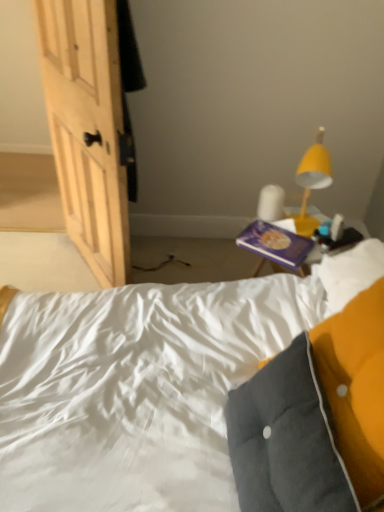
Question: Does velvety gray pillow at lower right come in front of yellow matte lamp at upper right?

Choices:
 (A) no
 (B) yes

Answer: (B)

Question: From a real-world perspective, is velvety gray pillow at lower right under yellow matte lamp at upper right?

Choices:
 (A) no
 (B) yes

Answer: (B)

Question: From a real-world perspective, does velvety gray pillow at lower right stand above yellow matte lamp at upper right?

Choices:
 (A) no
 (B) yes

Answer: (A)

Question: Would you say velvety gray pillow at lower right contains yellow matte lamp at upper right?

Choices:
 (A) yes
 (B) no

Answer: (B)

Question: Can you confirm if velvety gray pillow at lower right is wider than yellow matte lamp at upper right?

Choices:
 (A) yes
 (B) no

Answer: (A)

Question: Is velvety gray pillow at lower right in front of or behind yellow matte lamp at upper right in the image?

Choices:
 (A) behind
 (B) front

Answer: (B)

Question: From the image's perspective, is velvety gray pillow at lower right positioned above or below yellow matte lamp at upper right?

Choices:
 (A) above
 (B) below

Answer: (B)

Question: Considering the positions of velvety gray pillow at lower right and yellow matte lamp at upper right in the image, is velvety gray pillow at lower right wider or thinner than yellow matte lamp at upper right?

Choices:
 (A) wide
 (B) thin

Answer: (A)

Question: Considering the relative positions of velvety gray pillow at lower right and yellow matte lamp at upper right in the image provided, is velvety gray pillow at lower right to the left or to the right of yellow matte lamp at upper right?

Choices:
 (A) right
 (B) left

Answer: (B)

Question: Visually, is velvety gray pillow at lower right positioned to the left or to the right of purple matte book at upper right?

Choices:
 (A) right
 (B) left

Answer: (B)

Question: Considering the positions of velvety gray pillow at lower right and purple matte book at upper right in the image, is velvety gray pillow at lower right bigger or smaller than purple matte book at upper right?

Choices:
 (A) small
 (B) big

Answer: (B)

Question: From their relative heights in the image, would you say velvety gray pillow at lower right is taller or shorter than purple matte book at upper right?

Choices:
 (A) short
 (B) tall

Answer: (B)

Question: From a real-world perspective, is velvety gray pillow at lower right above or below purple matte book at upper right?

Choices:
 (A) below
 (B) above

Answer: (B)

Question: Relative to yellow matte lamp at upper right, is purple matte book at upper right in front or behind?

Choices:
 (A) behind
 (B) front

Answer: (A)

Question: From the image's perspective, is purple matte book at upper right above or below yellow matte lamp at upper right?

Choices:
 (A) below
 (B) above

Answer: (A)